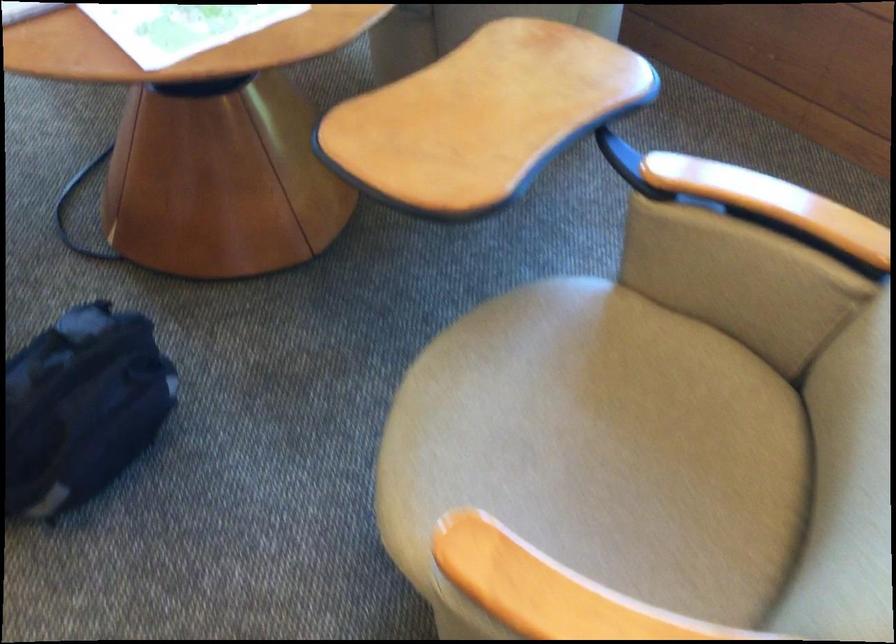
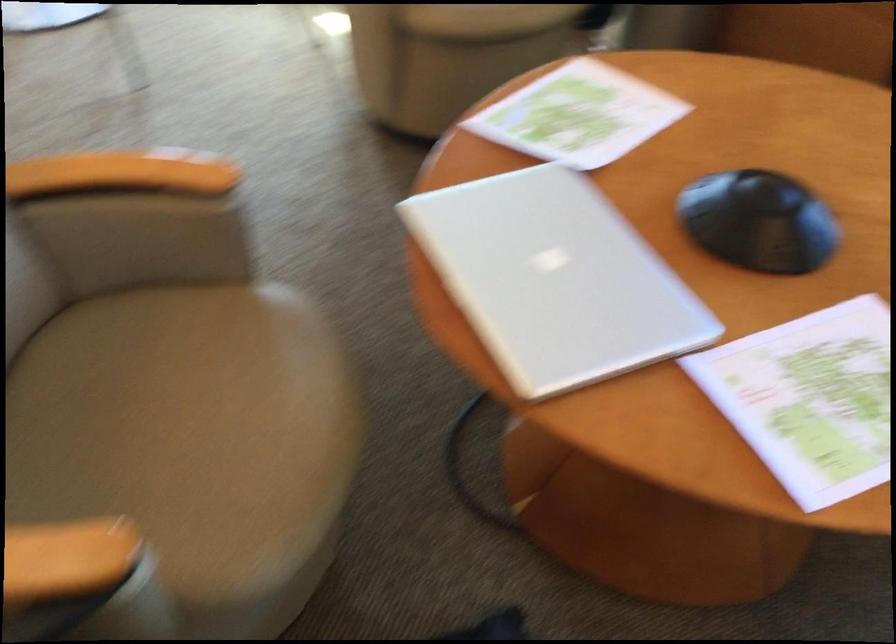
Question: How did the camera likely rotate?

Choices:
 (A) Left
 (B) Right
 (C) Up
 (D) Down

Answer: (A)